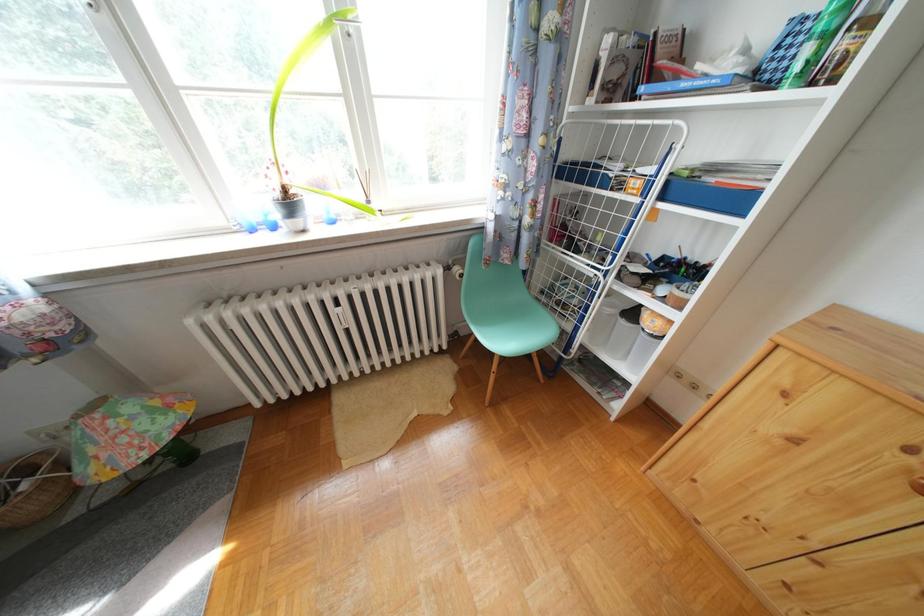
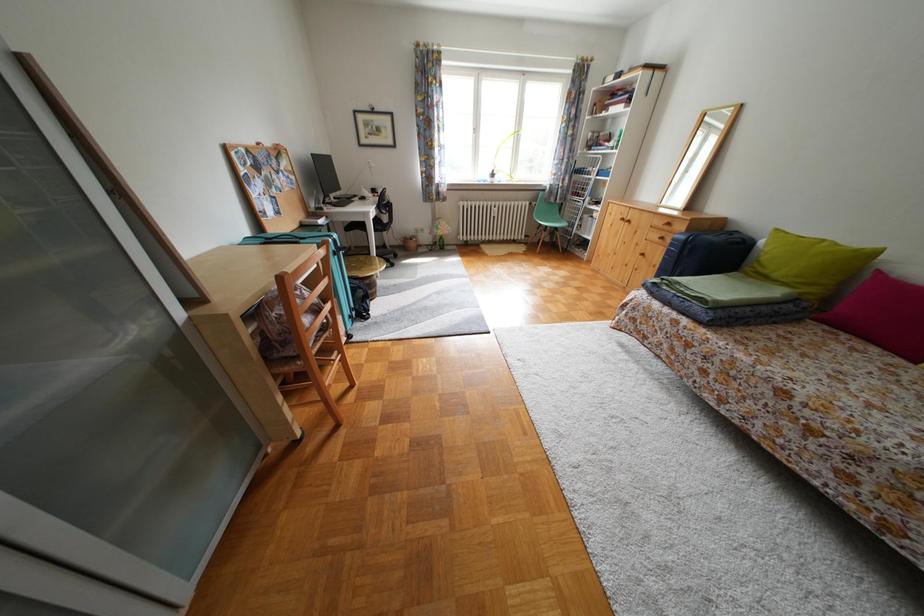
Question: What movement of the cameraman would produce the second image?

Choices:
 (A) Left
 (B) Right
 (C) Forward
 (D) Backward

Answer: (D)